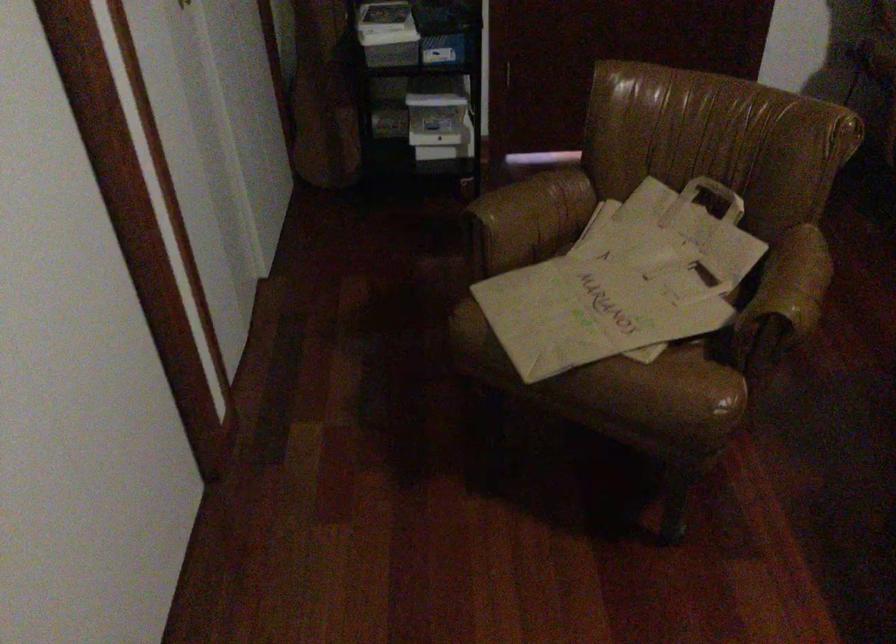
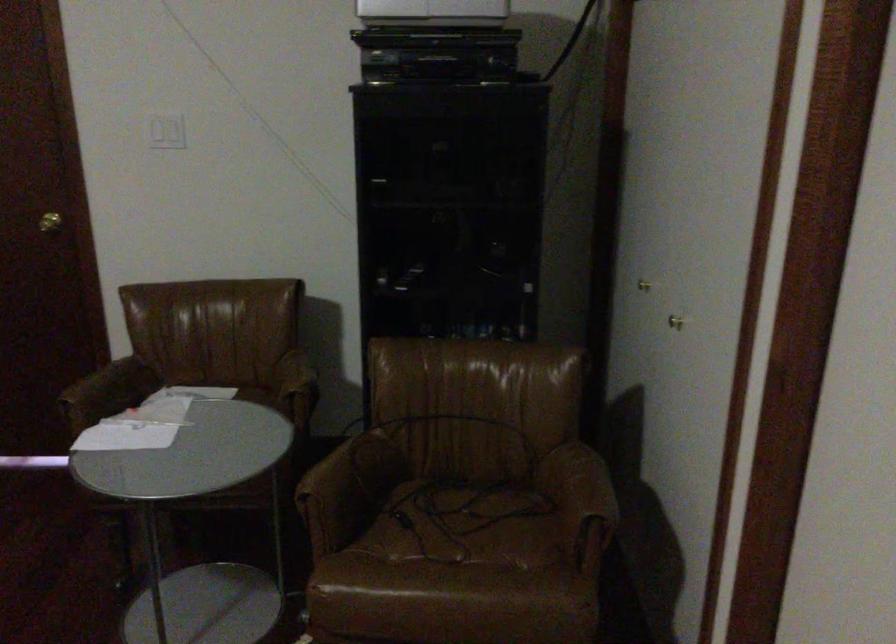
Question: The images are taken continuously from a first-person perspective. In which direction are you moving?

Choices:
 (A) Left
 (B) Right
 (C) Forward
 (D) Backward

Answer: (B)